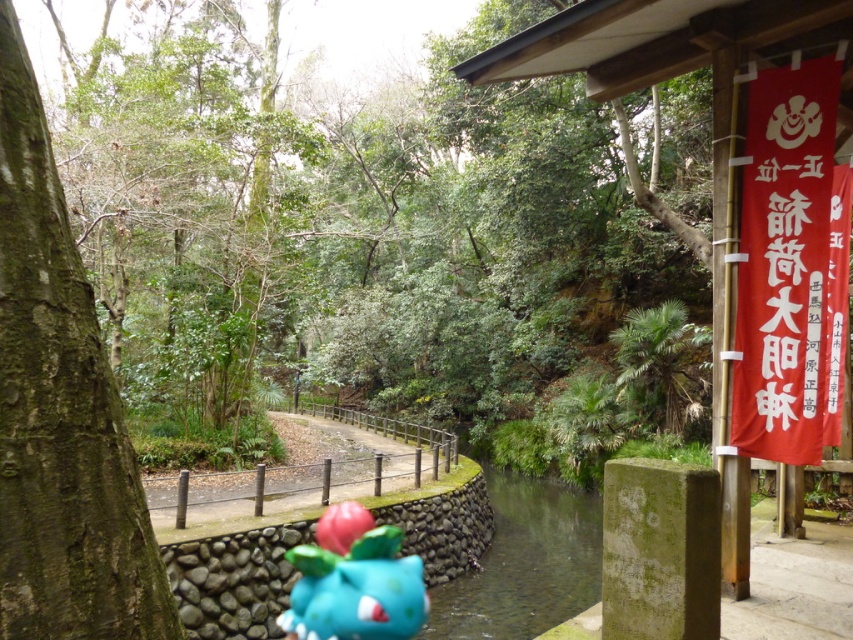
Question: Which point is closer to the camera taking this photo?

Choices:
 (A) (300, 593)
 (B) (44, 572)

Answer: (B)

Question: From the image, what is the correct spatial relationship of rough bark tree at left in relation to shiny blue plastic toy at center?

Choices:
 (A) above
 (B) below

Answer: (A)

Question: Does rough bark tree at left have a larger size compared to shiny blue plastic toy at center?

Choices:
 (A) yes
 (B) no

Answer: (B)

Question: Is rough bark tree at left to the right of shiny blue plastic toy at center from the viewer's perspective?

Choices:
 (A) no
 (B) yes

Answer: (A)

Question: Among these objects, which one is farthest from the camera?

Choices:
 (A) shiny blue plastic toy at center
 (B) rough bark tree at left

Answer: (A)